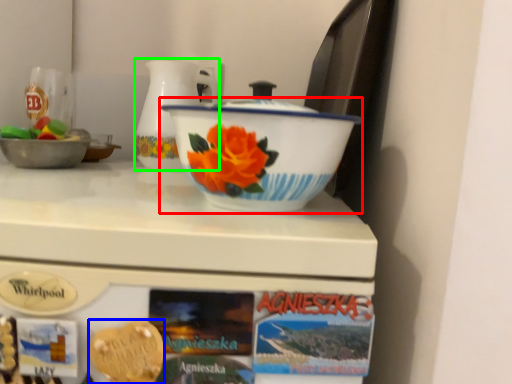
Question: Estimate the real-world distances between objects in this image. Which object is closer to basin (highlighted by a red box), food (highlighted by a blue box) or jug (highlighted by a green box)?

Choices:
 (A) food
 (B) jug

Answer: (A)